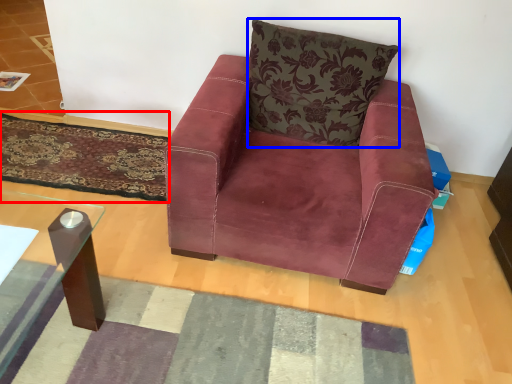
Question: Among these objects, which one is farthest to the camera, mat (highlighted by a red box) or pillow (highlighted by a blue box)?

Choices:
 (A) mat
 (B) pillow

Answer: (A)